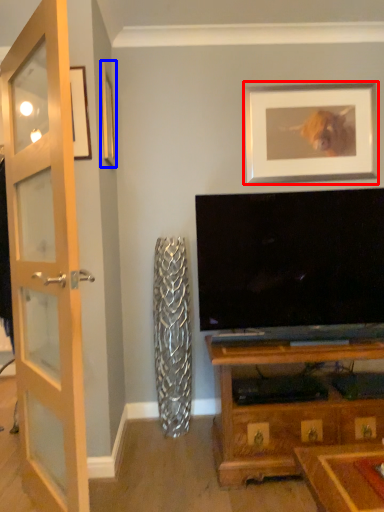
Question: Which object is closer to the camera taking this photo, picture frame (highlighted by a red box) or picture frame (highlighted by a blue box)?

Choices:
 (A) picture frame
 (B) picture frame

Answer: (B)